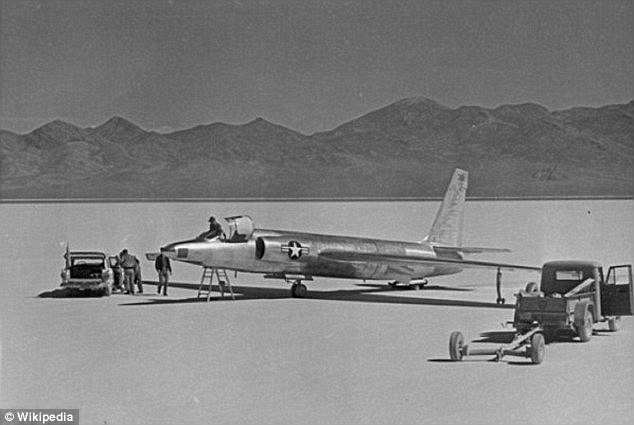
Find the location of a particular element. staircase is located at coordinates (209, 283).